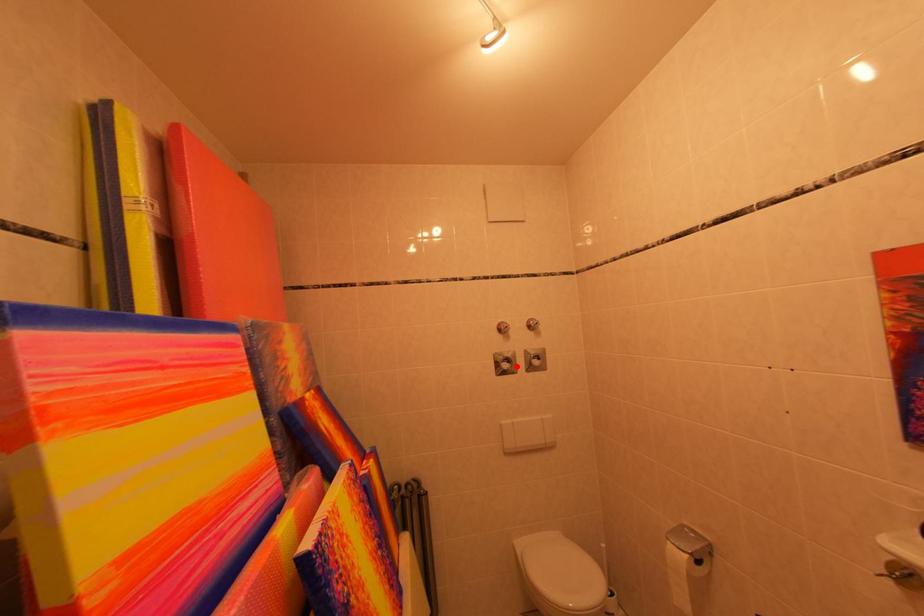
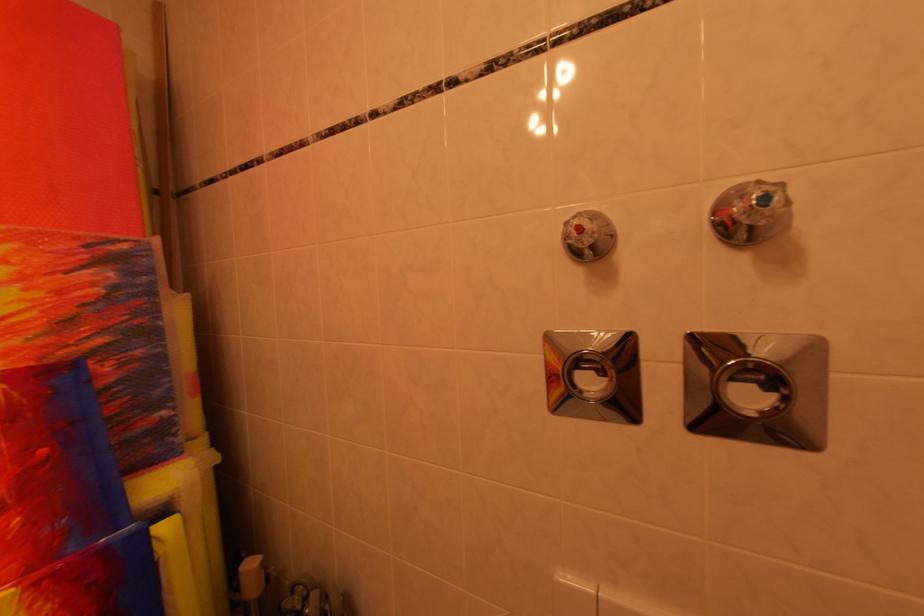
In the second image, find the point that corresponds to the highlighted location in the first image.

(608, 379)